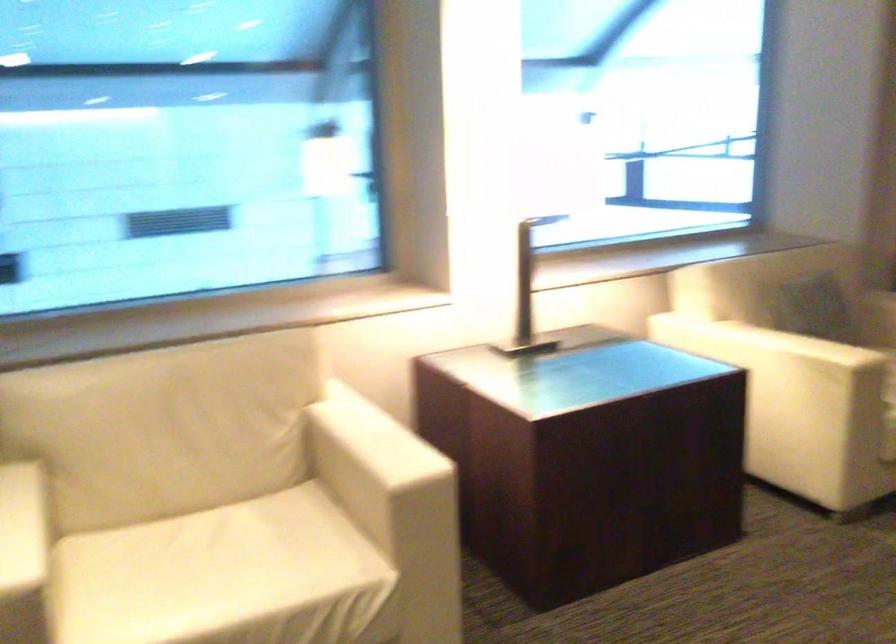
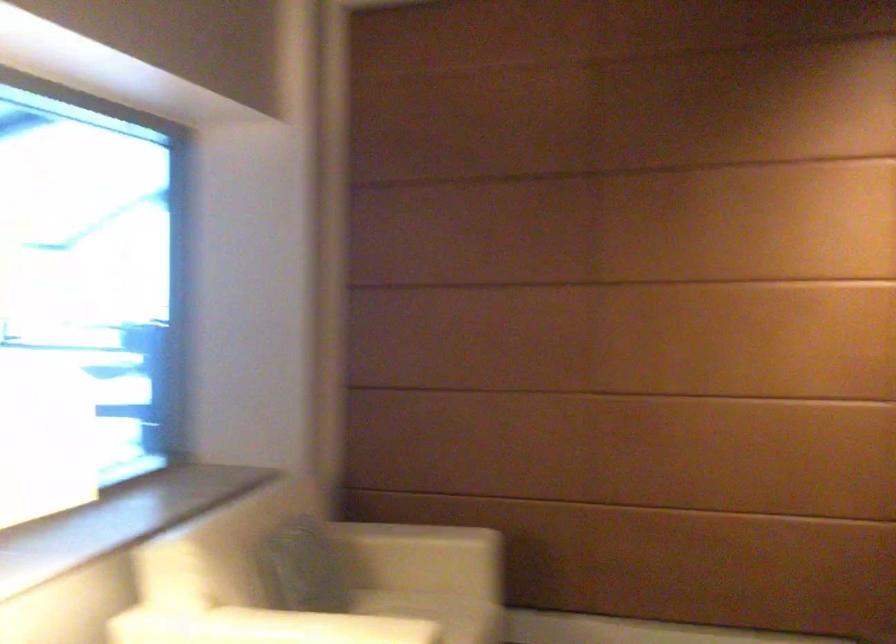
In the second image, find the point that corresponds to [752,321] in the first image.

(285, 625)